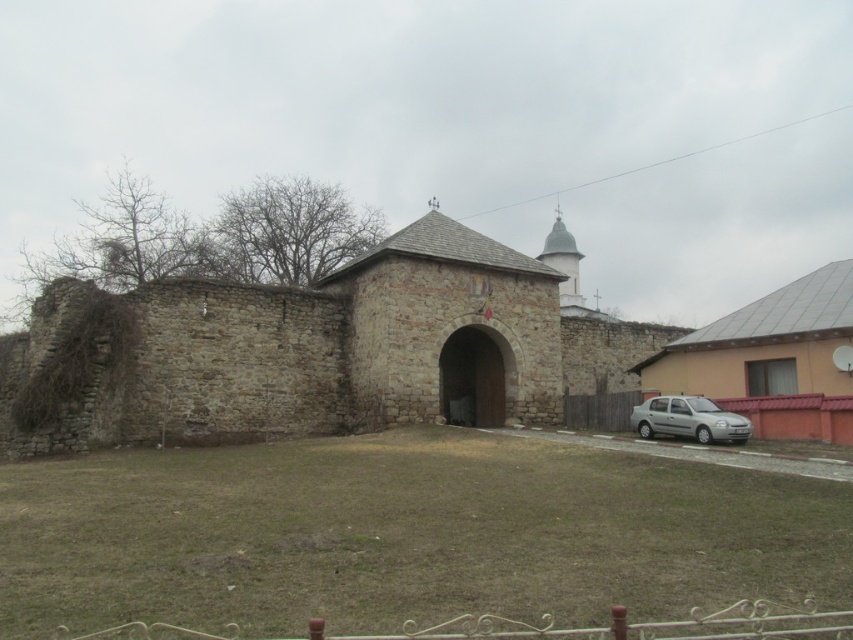
You are standing at the entrance of the historical stone structure and want to place a small decorative pot exactly at the center of the green grass at center. According to the coordinates provided, where should you position the pot?

The green grass at center is located at coordinates point (404, 534), so you should place the small decorative pot exactly at that point.

From the picture: You are standing in front of the historical stone structure. You see the green grass at center and the rustic stone church at center. Which object is located lower in the scene?

The green grass at center is located lower than the rustic stone church at center.